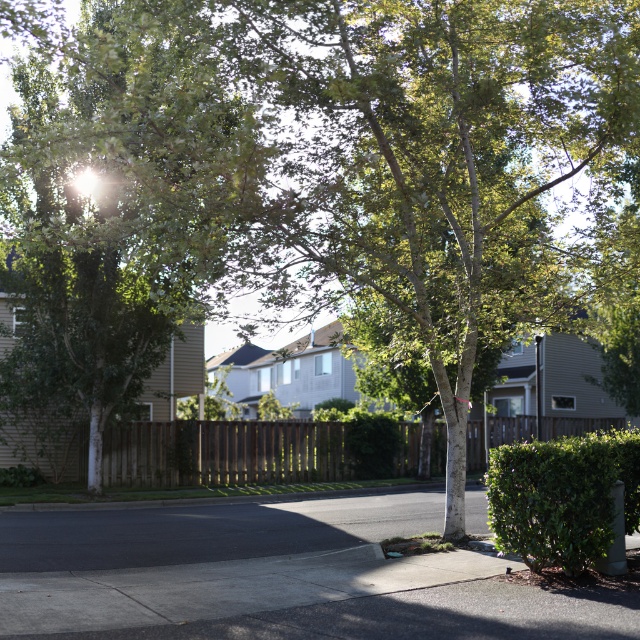
Question: Among these points, which one is farthest from the camera?

Choices:
 (A) (528, 438)
 (B) (577, 570)

Answer: (A)

Question: Does brown wood fence at center come behind green leafy hedge at lower right?

Choices:
 (A) no
 (B) yes

Answer: (B)

Question: Which of the following is the closest to the observer?

Choices:
 (A) green leafy hedge at lower right
 (B) brown wood fence at center

Answer: (A)

Question: Can you confirm if brown wood fence at center is thinner than green leafy hedge at lower right?

Choices:
 (A) no
 (B) yes

Answer: (A)

Question: Which of the following is the closest to the observer?

Choices:
 (A) (433, 474)
 (B) (540, 532)

Answer: (B)

Question: Does brown wood fence at center appear on the right side of green leafy hedge at lower right?

Choices:
 (A) no
 (B) yes

Answer: (B)